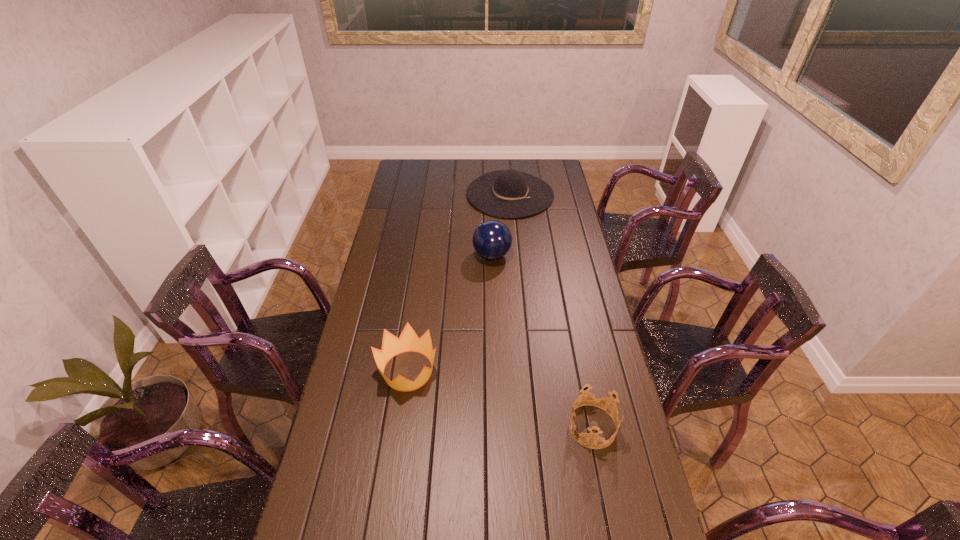
You are a GUI agent. You are given a task and a screenshot of the screen. Output one action in this format:
    pyautogui.click(x=<x>, y=<y>)
    Task: Click on the vacant point at the right edge
    The image size is (960, 540).
    Given the screenshot: What is the action you would take?
    pyautogui.click(x=561, y=239)

I want to click on free region at the far right corner, so click(x=559, y=169).

Find the location of `free space that is in between the tallest object and the second nearest object`. free space that is in between the tallest object and the second nearest object is located at coordinates 450,313.

What are the coordinates of `free space that is in between the tallest object and the nearer crown` in the screenshot? It's located at (542, 341).

This screenshot has width=960, height=540. In order to click on free space between the farther crown and the nearer crown in this screenshot , I will do 500,399.

The height and width of the screenshot is (540, 960). I want to click on free spot between the bowling ball and the leftmost object, so click(x=450, y=313).

Identify the location of free space between the nearest object and the tallest object. (542, 341).

This screenshot has width=960, height=540. I want to click on free spot between the third nearest object and the nearer crown, so click(542, 341).

The height and width of the screenshot is (540, 960). What are the coordinates of `object that is the closest to the third nearest object` in the screenshot? It's located at (509, 193).

Where is `object that stands as the closest to the third farthest object`? The image size is (960, 540). object that stands as the closest to the third farthest object is located at coordinates (602, 396).